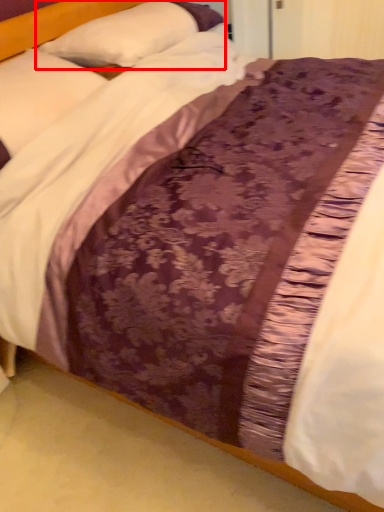
Question: In this image, where is pillow (annotated by the red box) located relative to pillow?

Choices:
 (A) left
 (B) right

Answer: (B)